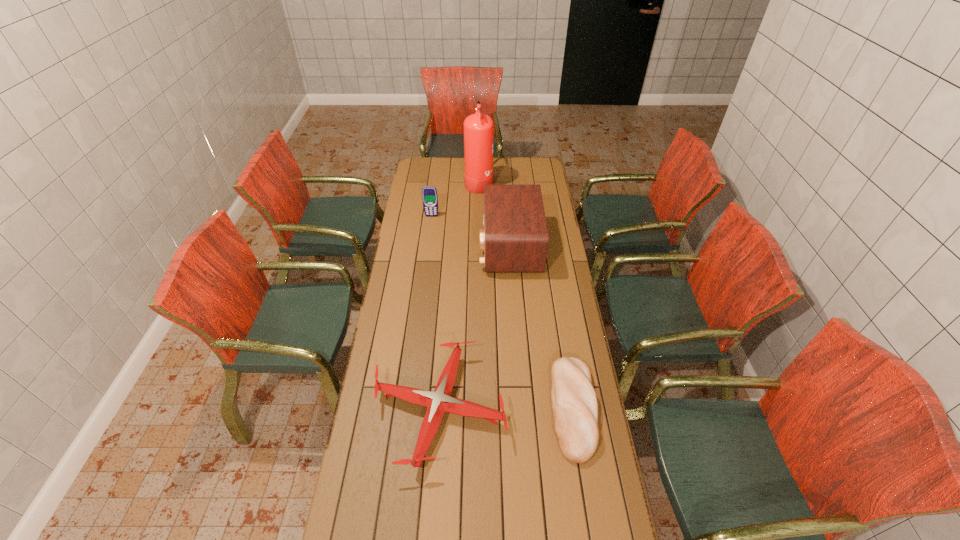
This screenshot has width=960, height=540. What are the coordinates of `vacant region located on the front panel of the fourth shortest object` in the screenshot? It's located at (425, 246).

I want to click on vacant region located on the front panel of the fourth shortest object, so click(x=467, y=246).

Locate an element on the screen. This screenshot has width=960, height=540. vacant space located on the front-facing side of the second farthest object is located at coordinates (427, 255).

This screenshot has width=960, height=540. In order to click on vacant region located 0.060m on the right of the drone in this screenshot , I will do `click(522, 409)`.

I want to click on vacant position located 0.200m on the front of the bread, so click(593, 536).

The height and width of the screenshot is (540, 960). In order to click on object at the far edge in this screenshot , I will do `click(478, 128)`.

Find the location of a particular element. cellular telephone present at the left edge is located at coordinates (429, 193).

This screenshot has width=960, height=540. Identify the location of drone at the left edge. (437, 402).

The height and width of the screenshot is (540, 960). I want to click on radio receiver at the right edge, so click(515, 238).

Image resolution: width=960 pixels, height=540 pixels. In order to click on bread present at the right edge in this screenshot , I will do `click(574, 402)`.